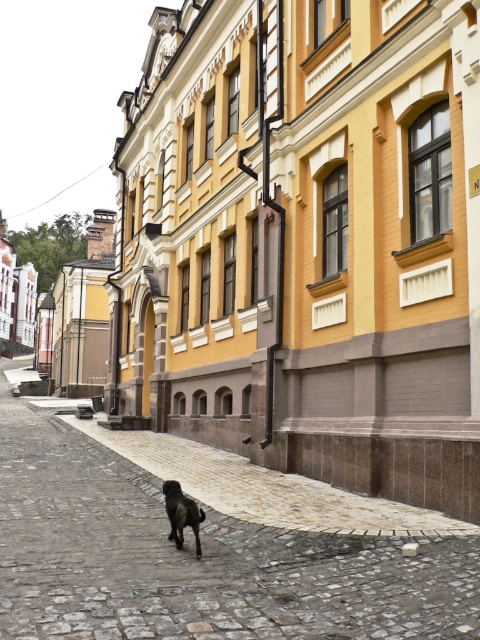
Question: Which point is farther to the camera?

Choices:
 (A) shiny black dog at center
 (B) gray cobblestone pavement at center

Answer: (A)

Question: Does gray cobblestone pavement at center appear on the right side of shiny black dog at center?

Choices:
 (A) no
 (B) yes

Answer: (A)

Question: Does gray cobblestone pavement at center appear on the right side of shiny black dog at center?

Choices:
 (A) no
 (B) yes

Answer: (A)

Question: Can you confirm if gray cobblestone pavement at center is smaller than shiny black dog at center?

Choices:
 (A) no
 (B) yes

Answer: (A)